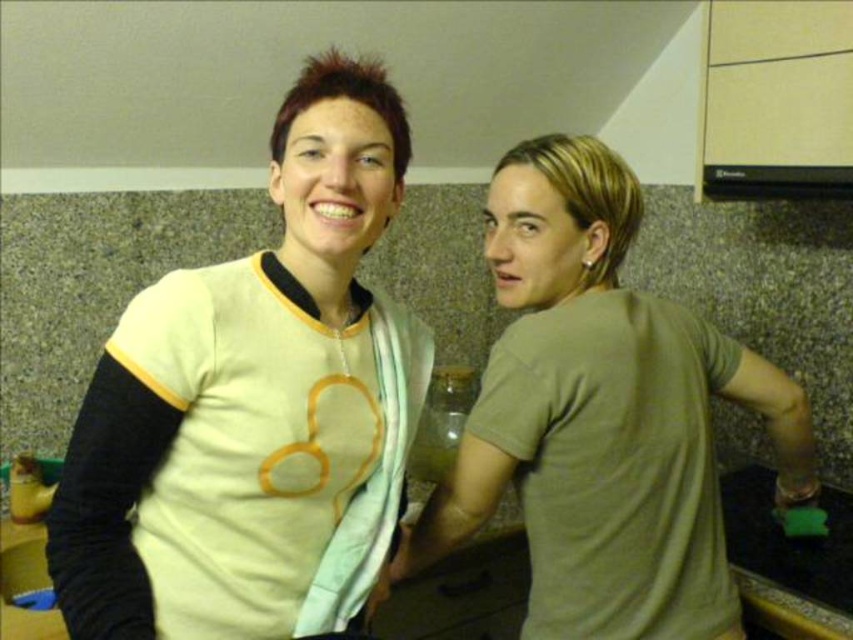
Question: Which point is closer to the camera?

Choices:
 (A) matte olive green t-shirt at right
 (B) translucent glass bottle at center

Answer: (A)

Question: Which object appears farthest from the camera in this image?

Choices:
 (A) translucent glass bottle at center
 (B) matte olive green t-shirt at right

Answer: (A)

Question: Which point is farther from the camera taking this photo?

Choices:
 (A) (576, 376)
 (B) (416, 451)

Answer: (B)

Question: In this image, where is matte olive green t-shirt at right located relative to translucent glass bottle at center?

Choices:
 (A) left
 (B) right

Answer: (B)

Question: Is matte olive green t-shirt at right positioned before translucent glass bottle at center?

Choices:
 (A) no
 (B) yes

Answer: (B)

Question: Does matte olive green t-shirt at right appear on the right side of translucent glass bottle at center?

Choices:
 (A) no
 (B) yes

Answer: (B)